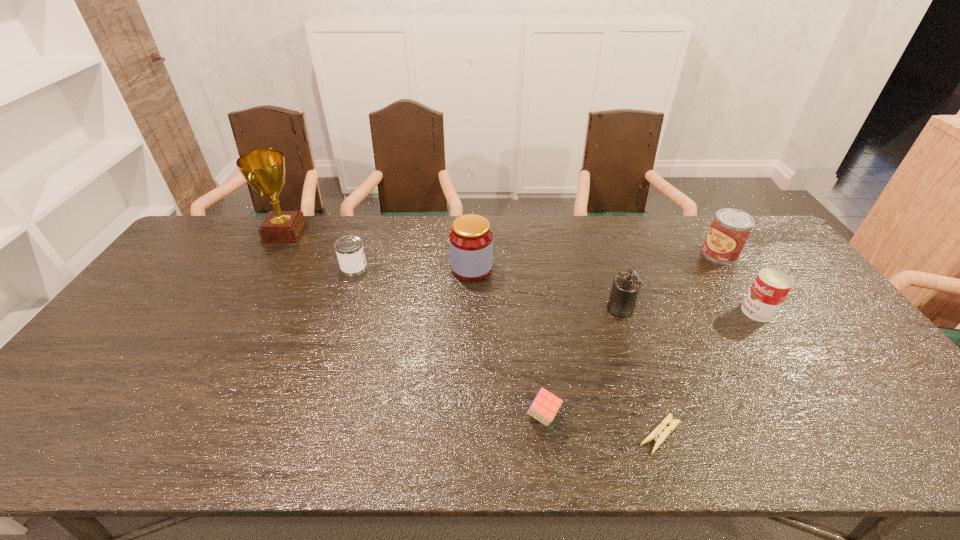
Image resolution: width=960 pixels, height=540 pixels. Identify the location of clothespin located at the near edge. (656, 434).

I want to click on object at the right edge, so click(730, 229).

This screenshot has width=960, height=540. Find the location of `object located in the far right corner section of the desktop`. object located in the far right corner section of the desktop is located at coordinates (730, 229).

Where is `vacant space at the far edge of the desktop`? The image size is (960, 540). vacant space at the far edge of the desktop is located at coordinates (397, 250).

The image size is (960, 540). In the image, there is a desktop. What are the coordinates of `vacant space at the near edge` in the screenshot? It's located at (530, 456).

This screenshot has height=540, width=960. I want to click on vacant space at the left edge of the desktop, so click(x=116, y=334).

The width and height of the screenshot is (960, 540). Identify the location of vacant space at the right edge of the desktop. (789, 267).

Locate an element on the screen. The width and height of the screenshot is (960, 540). free space at the far left corner is located at coordinates (213, 255).

Locate an element on the screen. The height and width of the screenshot is (540, 960). vacant area between the award and the seventh tallest object is located at coordinates (414, 325).

Where is `free space between the shortest can and the second can from left to right`? free space between the shortest can and the second can from left to right is located at coordinates (488, 288).